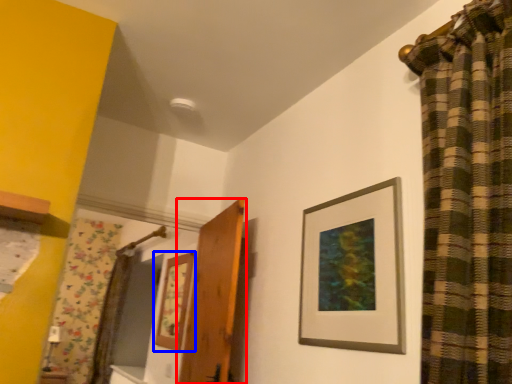
Question: Which of the following is the closest to the observer, door (highlighted by a red box) or picture frame (highlighted by a blue box)?

Choices:
 (A) door
 (B) picture frame

Answer: (A)